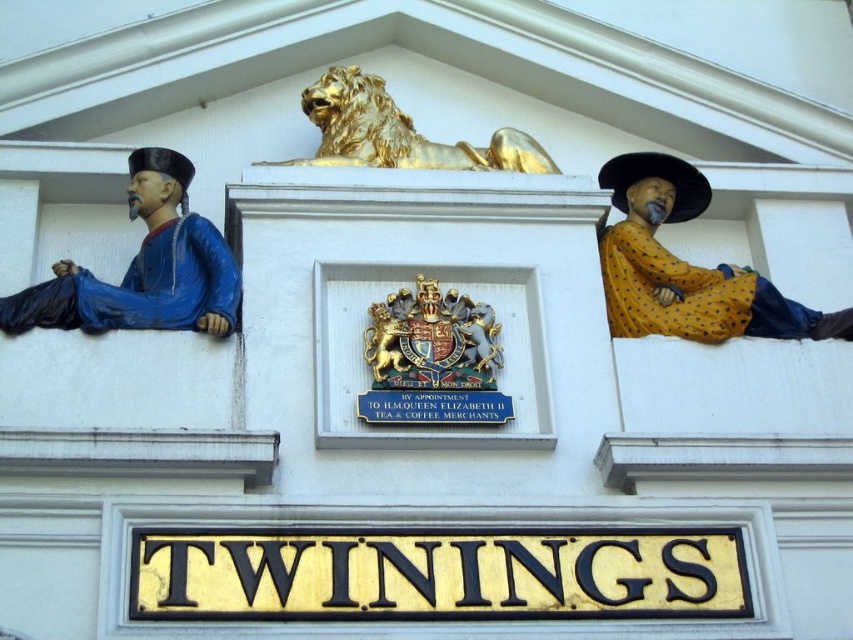
Can you confirm if yellow dotted fabric at right is shorter than gold metallic lion at center?

No.

This screenshot has height=640, width=853. In order to click on yellow dotted fabric at right in this screenshot , I will do `click(686, 266)`.

Looking at this image, does gold/black metal sign at center have a smaller size compared to gold metallic coat of arms at center?

No, gold/black metal sign at center is not smaller than gold metallic coat of arms at center.

Measure the distance between gold/black metal sign at center and camera.

They are 44.63 meters apart.

You are a GUI agent. You are given a task and a screenshot of the screen. Output one action in this format:
    pyautogui.click(x=<x>, y=<y>)
    Task: Click on the gold/black metal sign at center
    The image size is (853, 640).
    Given the screenshot: What is the action you would take?
    pyautogui.click(x=436, y=573)

Find the location of a particular element. This screenshot has height=640, width=853. gold/black metal sign at center is located at coordinates (436, 573).

Between gold/black metal sign at center and yellow dotted fabric at right, which one is positioned higher?

yellow dotted fabric at right is above.

Is point (554, 586) positioned after point (654, 323)?

That is False.

Where is `gold/black metal sign at center`? The height and width of the screenshot is (640, 853). gold/black metal sign at center is located at coordinates (436, 573).